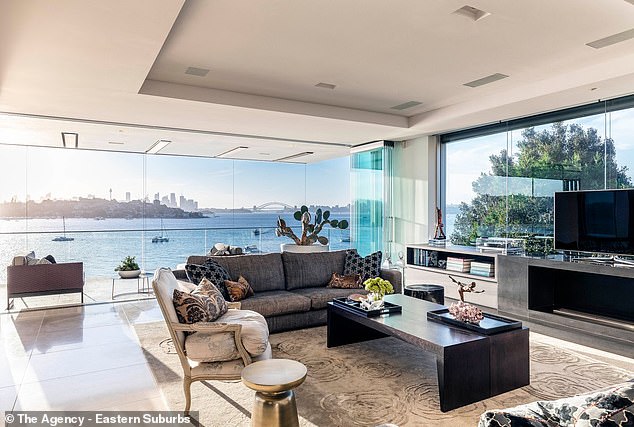
Locate an element on the screen. The image size is (634, 427). serving tray is located at coordinates (372, 310).